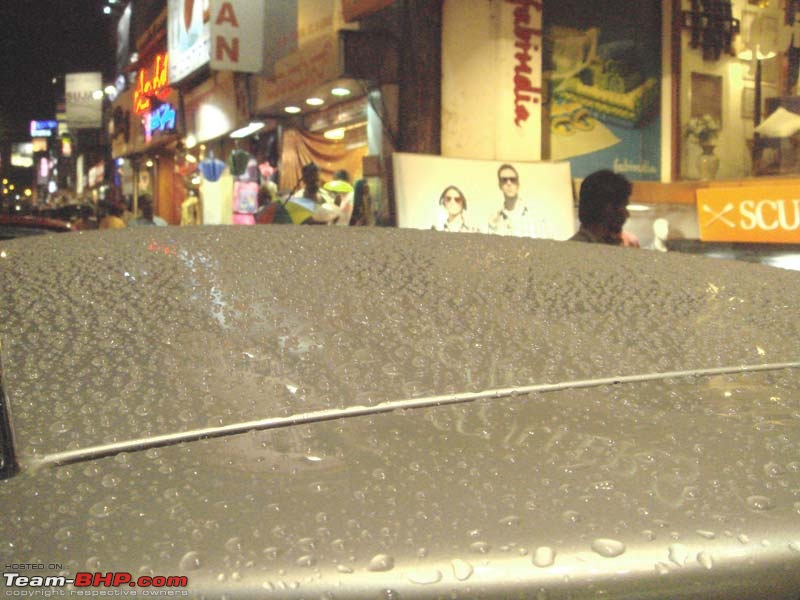
Find the location of a particular element. lights is located at coordinates (12, 192), (41, 192), (114, 96), (190, 148), (296, 113), (316, 104), (350, 96), (750, 58).